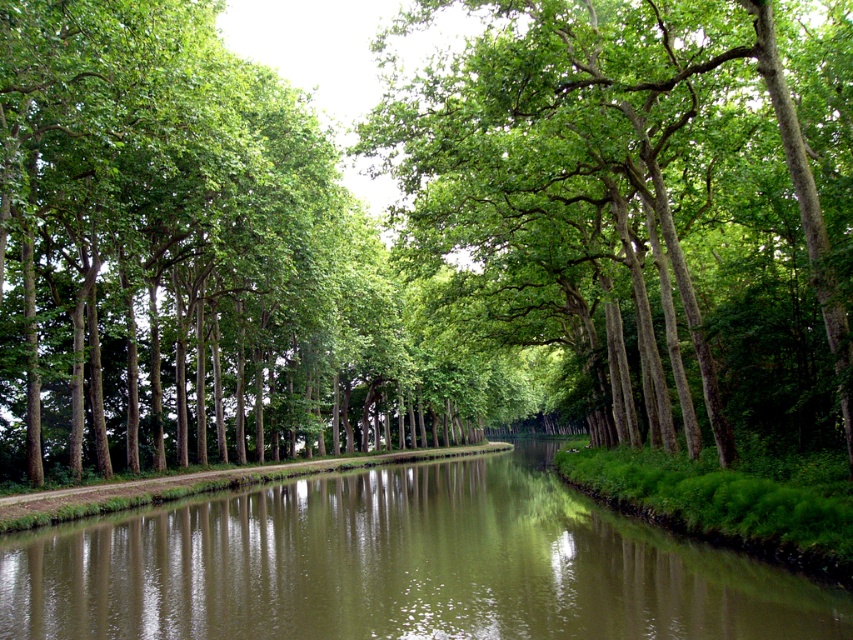
Is point (721, 225) positioned after point (247, 580)?

Yes, point (721, 225) is farther from viewer.

Does point (624, 88) lie in front of point (711, 573)?

No, (624, 88) is further to viewer.

You are a GUI agent. You are given a task and a screenshot of the screen. Output one action in this format:
    pyautogui.click(x=<x>, y=<y>)
    Task: Click on the green leafy trees at center
    The height and width of the screenshot is (640, 853).
    Given the screenshot: What is the action you would take?
    pyautogui.click(x=650, y=195)

I want to click on green leafy trees at center, so click(650, 195).